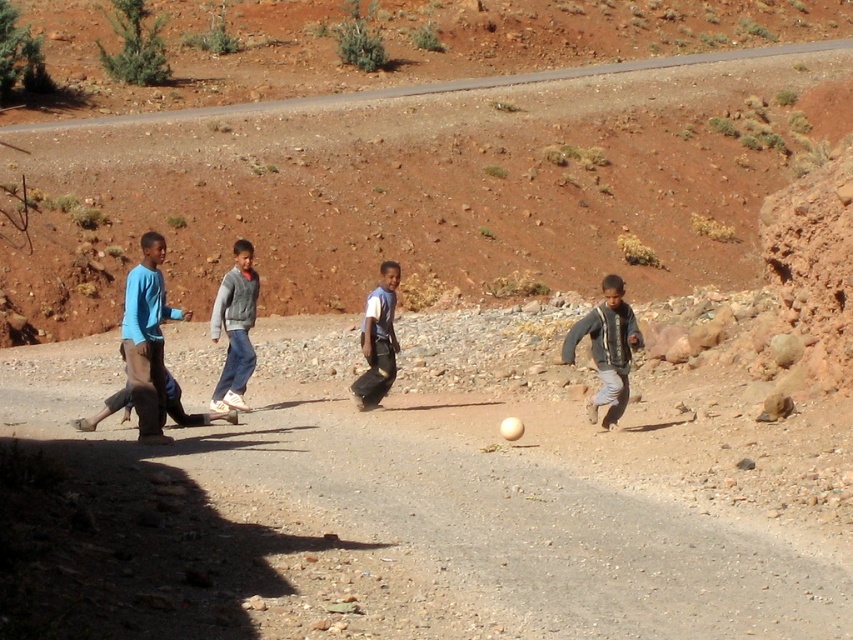
You are a photographer trying to capture a photo of the gray fleece jacket at center and the brown gravel road at center. You want to ensure that both are fully visible in the frame. Given that the jacket is smaller than the road, can you adjust your camera angle to include both without cropping either?

The brown gravel road at center is wider than the gray fleece jacket at center, so adjusting the camera angle to include both should be possible by framing the shot so the jacket is centered and the road extends outward on both sides, ensuring neither is cropped.

You are a photographer trying to capture a photo of the soccer game. You want to ensure both the gray textured jacket at right and the white matte shirt at center are clearly visible in the frame. Based on their positions, which object should you focus on first to ensure both are in focus?

The gray textured jacket at right is located below the white matte shirt at center. To ensure both are in focus, you should focus on the white matte shirt at center first since it is higher up, allowing the depth of field to naturally include the lower positioned gray textured jacket at right.